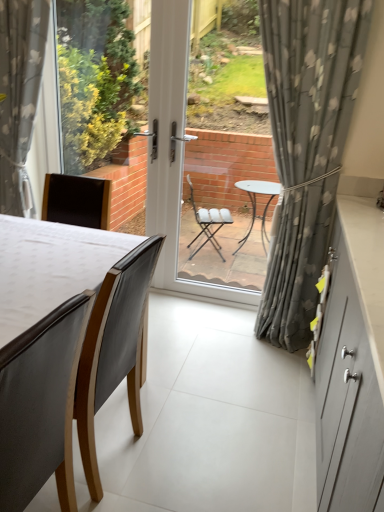
Question: Is matte black chair at left, acting as the 2th chair starting from the front, inside or outside of dark brown leather chair at lower left, placed as the first chair when sorted from front to back?

Choices:
 (A) inside
 (B) outside

Answer: (B)

Question: Considering the positions of matte black chair at left, acting as the 2th chair starting from the front, and dark brown leather chair at lower left, placed as the first chair when sorted from front to back, in the image, is matte black chair at left, acting as the 2th chair starting from the front, taller or shorter than dark brown leather chair at lower left, placed as the first chair when sorted from front to back,?

Choices:
 (A) short
 (B) tall

Answer: (B)

Question: Which object is positioned farthest from the matte gray cabinet at right?

Choices:
 (A) matte black chair at left, acting as the 2th chair starting from the front
 (B) gray floral curtain at center, positioned as the first curtain in right-to-left order
 (C) gray floral fabric curtain at left, which is the second curtain from right to left
 (D) dark brown leather chair at lower left, placed as the first chair when sorted from front to back
 (E) transparent glass door at center

Answer: (E)

Question: Considering the real-world distances, which object is farthest from the transparent glass door at center?

Choices:
 (A) gray floral curtain at center, positioned as the first curtain in right-to-left order
 (B) matte black chair at left, which ranks as the first chair in back-to-front order
 (C) matte gray cabinet at right
 (D) gray floral fabric curtain at left, acting as the first curtain starting from the left
 (E) dark brown leather chair at lower left, placed as the first chair when sorted from front to back

Answer: (E)